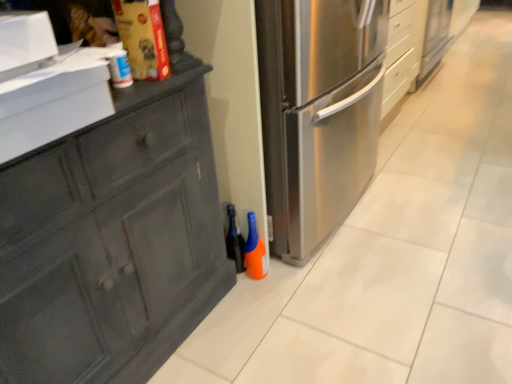
Identify the location of vacant point to the right of translucent orange spray bottle at lower center, the 2th bottle from the right. (285, 271).